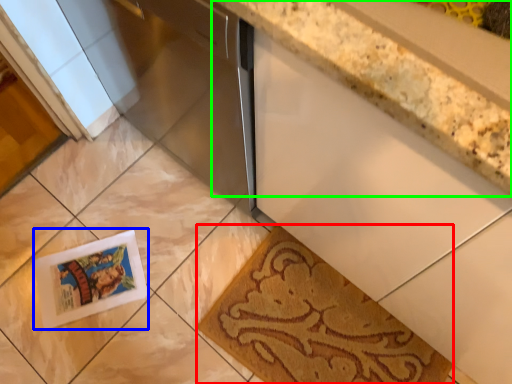
Question: Considering the real-world distances, which object is closest to mat (highlighted by a red box)? postcard (highlighted by a blue box) or countertop (highlighted by a green box).

Choices:
 (A) postcard
 (B) countertop

Answer: (A)